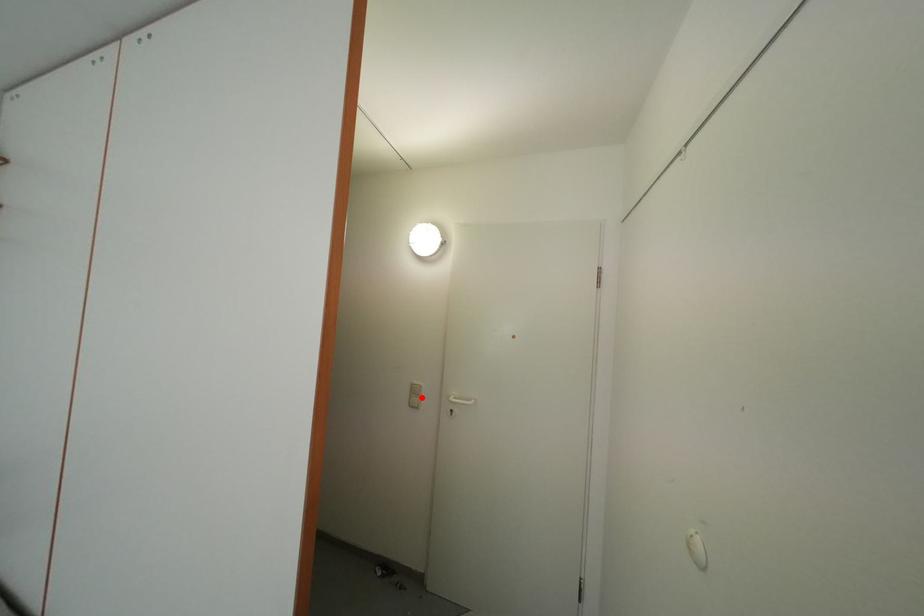
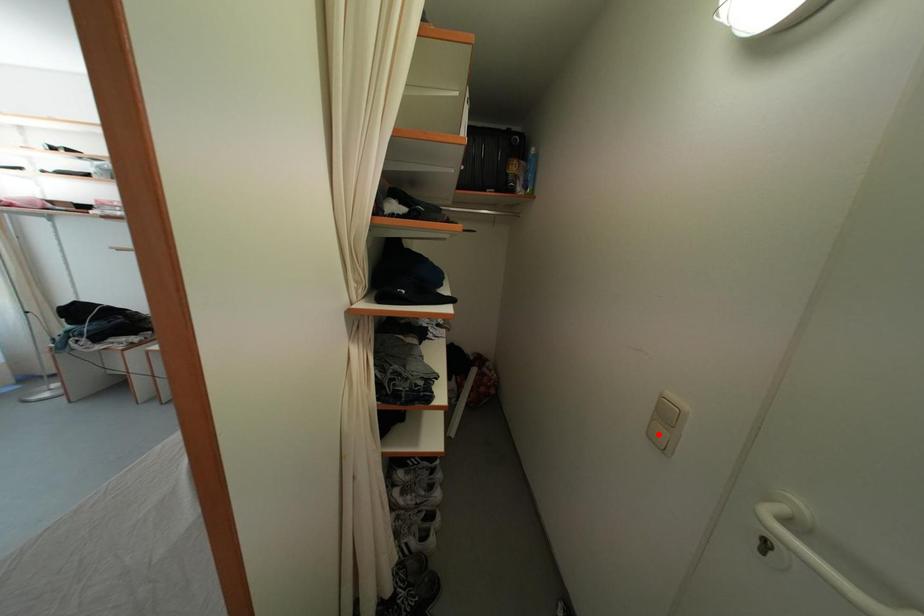
I am providing you with two images of the same scene from different viewpoints. A red point is marked on the first image and another point is marked on the second image. Is the marked point in image1 the same physical position as the marked point in image2?

No